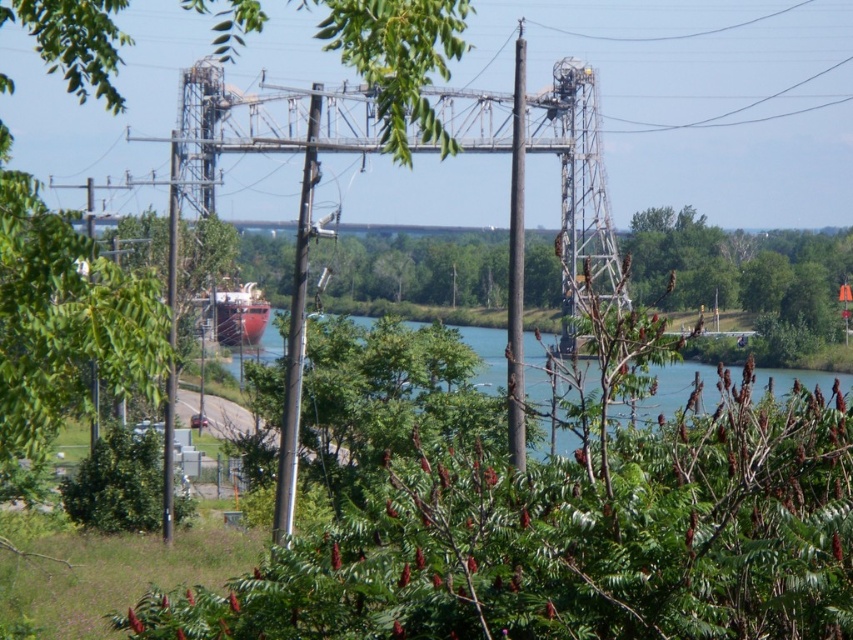
You are standing at the center of the image and want to locate the brown wood pole at center. In which direction should you look to find it?

The brown wood pole at center is located at point (x=515, y=266), so you should look directly ahead since it is at the center of the image.